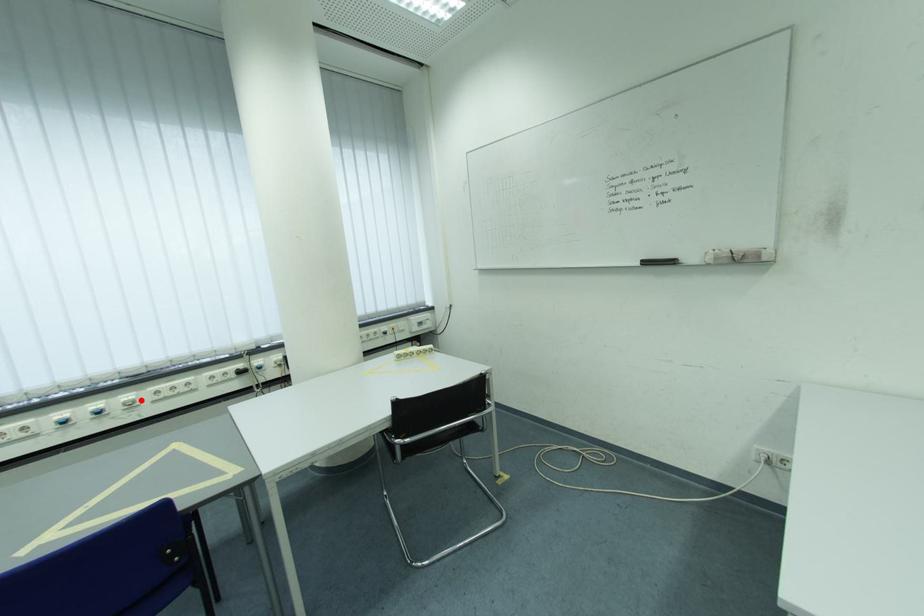
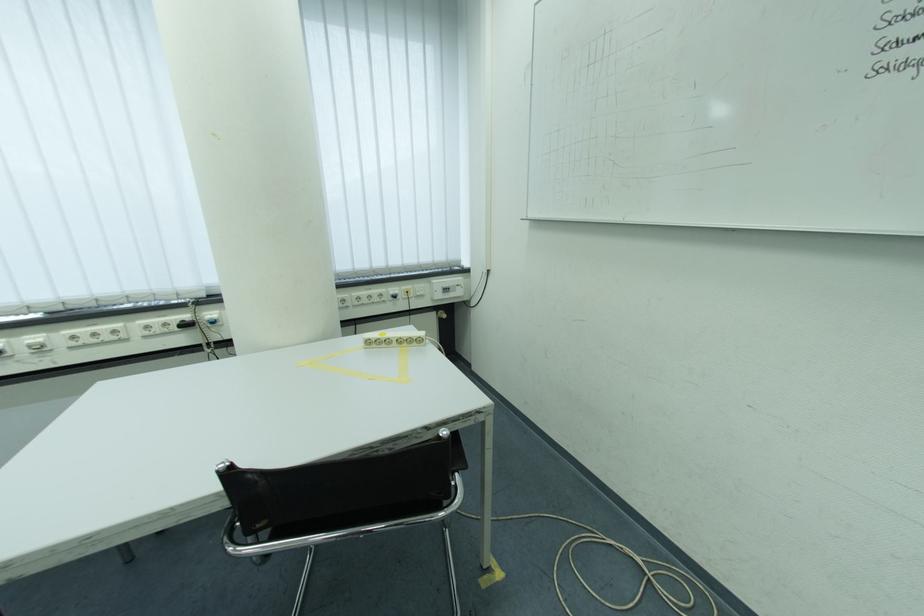
In the second image, find the point that corresponds to the highlighted location in the first image.

(50, 342)